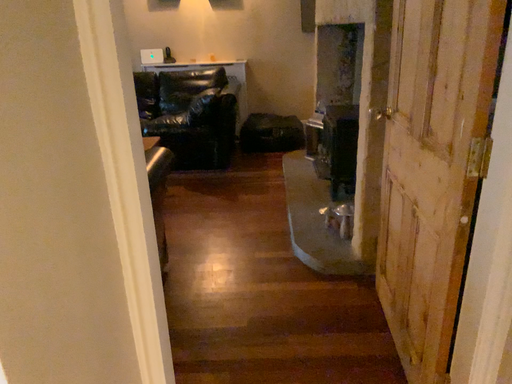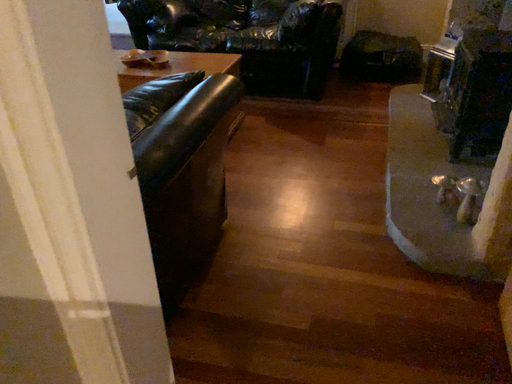
Question: Which way did the camera rotate in the video?

Choices:
 (A) rotated upward
 (B) rotated downward

Answer: (B)